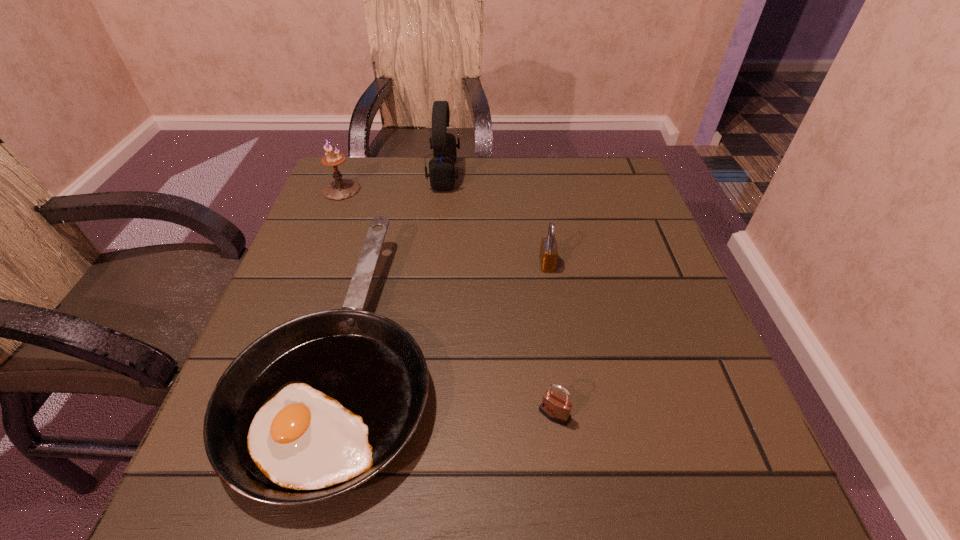
Locate an element on the screen. The image size is (960, 540). free region located 0.130m on the back of the frying pan is located at coordinates (381, 207).

At what (x,y) coordinates should I click in order to perform the action: click on headset present at the far edge. Please return your answer as a coordinate pair (x, y). The width and height of the screenshot is (960, 540). Looking at the image, I should click on (442, 174).

Image resolution: width=960 pixels, height=540 pixels. I want to click on candle holder positioned at the far edge, so click(341, 188).

The width and height of the screenshot is (960, 540). I want to click on object situated at the near edge, so click(x=315, y=407).

Find the location of a particular element. candle holder that is at the left edge is located at coordinates tap(341, 188).

This screenshot has width=960, height=540. What are the coordinates of `frying pan that is at the left edge` in the screenshot? It's located at (315, 407).

The width and height of the screenshot is (960, 540). What are the coordinates of `object present at the far left corner` in the screenshot? It's located at (341, 188).

Identify the location of object that is at the near left corner. This screenshot has height=540, width=960. (315, 407).

Image resolution: width=960 pixels, height=540 pixels. Find the location of `vacant space at the far edge`. vacant space at the far edge is located at coordinates (531, 158).

The height and width of the screenshot is (540, 960). In the image, there is a desktop. Identify the location of vacant region at the left edge. (317, 275).